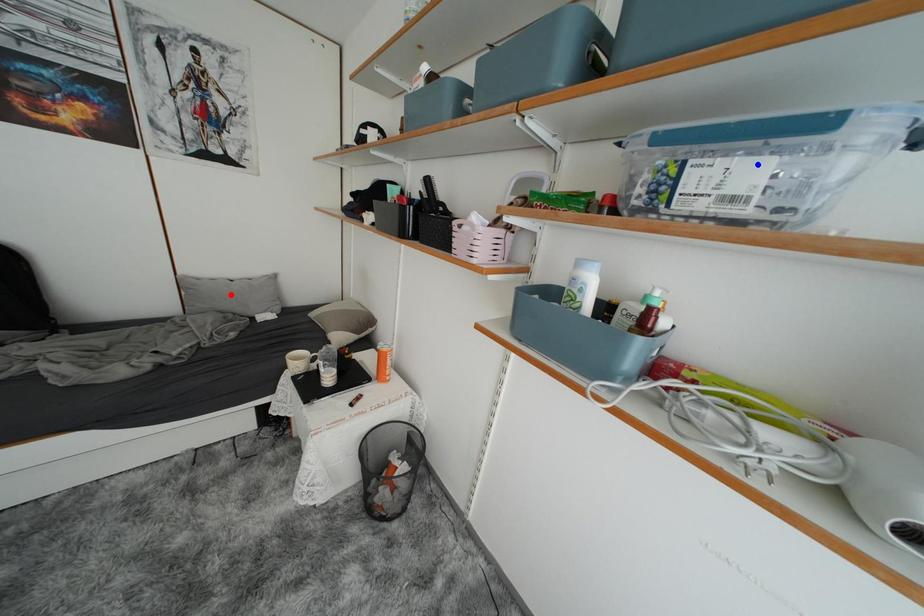
Question: In the image, two points are highlighted. Which point is nearer to the camera? Reply with the corresponding letter.

Choices:
 (A) blue point
 (B) red point

Answer: (A)